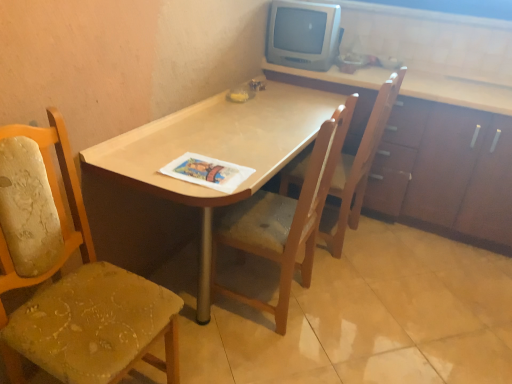
I want to click on vacant area that is situated to the right of wooden chair at center, placed as the 1th chair when sorted from right to left, so click(400, 258).